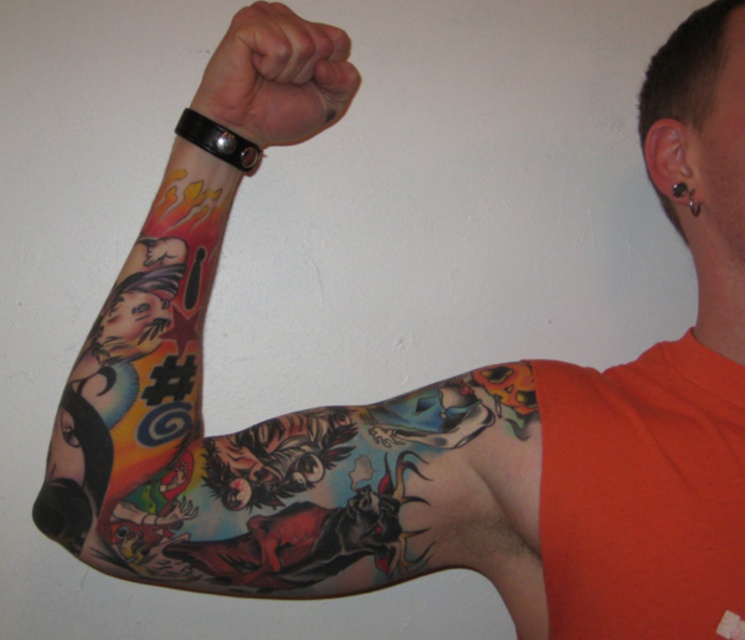
You are a tattoo artist assessing the placement of a new design. You see the colorful tattooed arm at upper left and the black leather wristband at upper center. Which object occupies more vertical space in the image?

The colorful tattooed arm at upper left occupies more vertical space because it has a greater height compared to the black leather wristband at upper center.

You are a tattoo artist assessing the placement of a new tattoo on the arm. You see the colorful tattooed arm at upper left and the black leather wristband at upper center. Which object is closer to you, the observer?

The colorful tattooed arm at upper left is closer to the observer because it is in front of the black leather wristband at upper center.

You are a tattoo artist assessing the placement of a new tattoo on the arm. The client wants to add a small star tattoo above the black leather wristband at upper center. Considering the current placement of the colorful tattooed arm at upper left, will there be enough space?

The colorful tattooed arm at upper left is positioned under the black leather wristband at upper center, so there is space above the black leather wristband at upper center to add the small star tattoo.